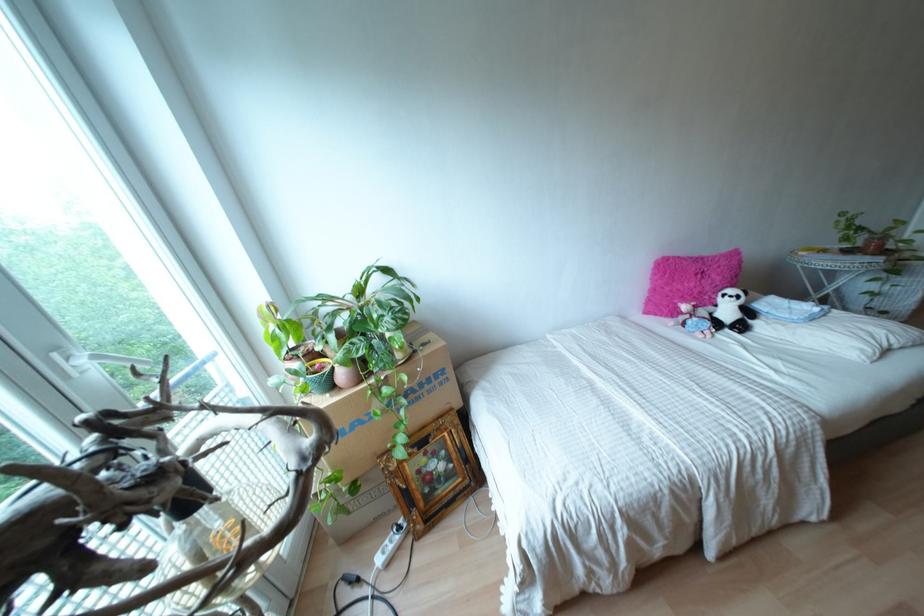
I want to click on pink fluffy pillow, so click(689, 281).